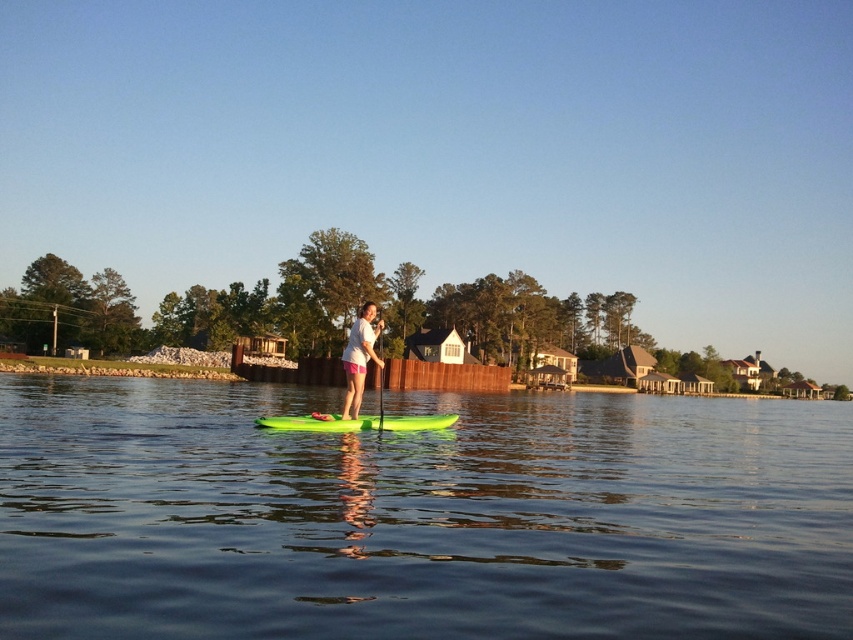
Question: Is green rubber canoe at center wider than white matte shirt at center?

Choices:
 (A) no
 (B) yes

Answer: (A)

Question: Which point is closer to the camera taking this photo?

Choices:
 (A) (380, 381)
 (B) (369, 342)

Answer: (B)

Question: Is green rubber paddleboard at center further to camera compared to green rubber canoe at center?

Choices:
 (A) no
 (B) yes

Answer: (A)

Question: Which point is closer to the camera?

Choices:
 (A) (389, 449)
 (B) (378, 326)
 (C) (381, 428)
 (D) (450, 424)

Answer: (A)

Question: Which point is farther from the camera taking this photo?

Choices:
 (A) (25, 572)
 (B) (381, 332)

Answer: (B)

Question: Is white matte shirt at center to the right of green rubber paddle at center from the viewer's perspective?

Choices:
 (A) yes
 (B) no

Answer: (A)